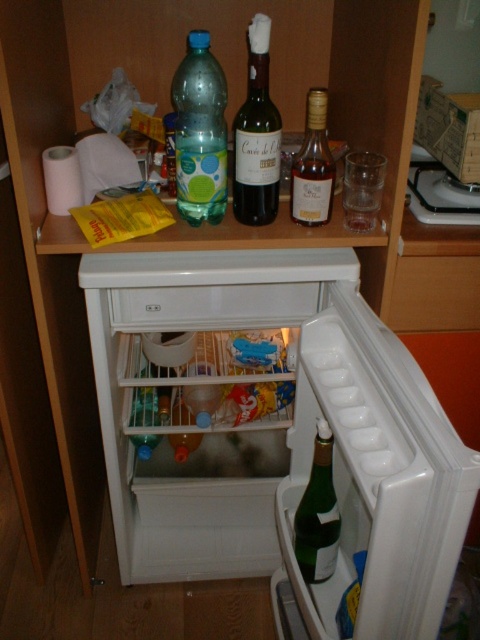
Question: Which object is the closest to the green glass bottle at center?

Choices:
 (A) green glass bottle at lower right
 (B) wooden drawer at center
 (C) translucent plastic bottle at upper center

Answer: (C)

Question: Which point is closer to the camera?

Choices:
 (A) translucent glass bottle at upper center
 (B) wooden drawer at center

Answer: (A)

Question: Can you confirm if translucent plastic bottle at upper center is wider than translucent glass bottle at upper center?

Choices:
 (A) no
 (B) yes

Answer: (B)

Question: Does green glass bottle at lower center have a lesser width compared to wooden drawer at center?

Choices:
 (A) no
 (B) yes

Answer: (A)

Question: Is wooden drawer at center smaller than green glass bottle at lower right?

Choices:
 (A) no
 (B) yes

Answer: (B)

Question: Which object appears closest to the camera in this image?

Choices:
 (A) wooden drawer at center
 (B) green glass bottle at lower right
 (C) translucent glass bottle at upper center

Answer: (C)